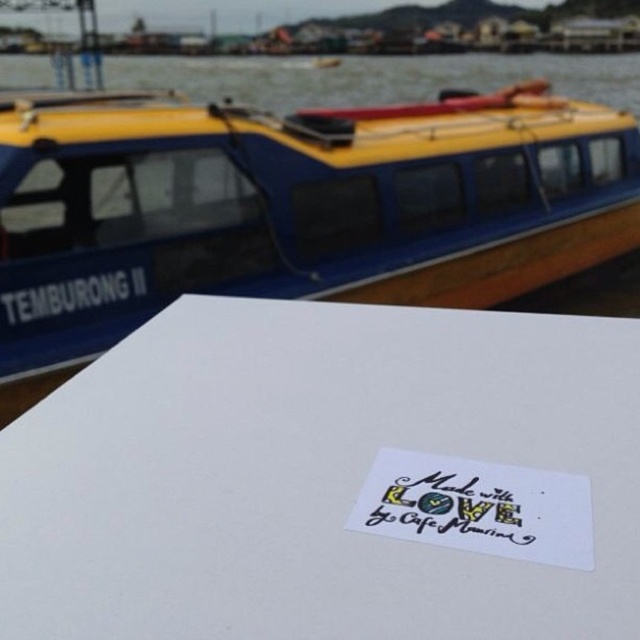
Does white paper at lower center appear on the right side of handwritten paper at center?

In fact, white paper at lower center is to the left of handwritten paper at center.

Is white paper at lower center below handwritten paper at center?

No, white paper at lower center is not below handwritten paper at center.

The width and height of the screenshot is (640, 640). I want to click on white paper at lower center, so click(x=330, y=480).

Image resolution: width=640 pixels, height=640 pixels. What are the coordinates of `white paper at lower center` in the screenshot? It's located at (330, 480).

Which is below, yellow matte boat at upper left or handwritten paper at center?

handwritten paper at center is lower down.

Does yellow matte boat at upper left have a lesser width compared to handwritten paper at center?

In fact, yellow matte boat at upper left might be wider than handwritten paper at center.

Which is in front, point (312, 192) or point (403, 451)?

Point (403, 451) is more forward.

Where is `yellow matte boat at upper left`? This screenshot has height=640, width=640. yellow matte boat at upper left is located at coordinates (292, 205).

Which is below, white paper at lower center or yellow matte boat at upper left?

white paper at lower center is below.

Which is above, white paper at lower center or yellow matte boat at upper left?

Positioned higher is yellow matte boat at upper left.

Does point (397, 320) come behind point (282, 243)?

No, it is in front of (282, 243).

This screenshot has width=640, height=640. Identify the location of white paper at lower center. (330, 480).